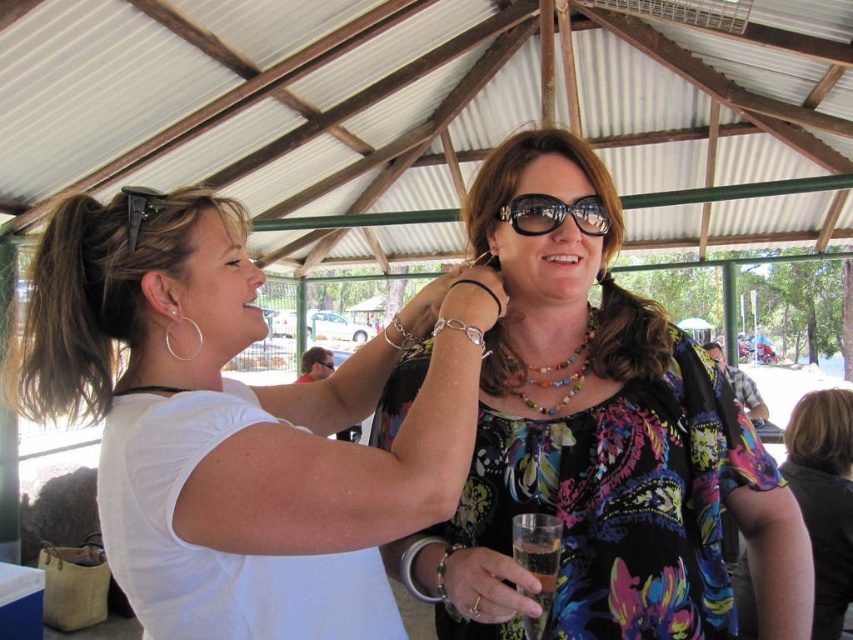
Is white matte shirt at upper left in front of multicolored beaded necklace at center?

That is True.

Is white matte shirt at upper left to the left of multicolored beaded necklace at center from the viewer's perspective?

Indeed, white matte shirt at upper left is positioned on the left side of multicolored beaded necklace at center.

This screenshot has width=853, height=640. In order to click on white matte shirt at upper left in this screenshot , I will do `click(238, 422)`.

Is white matte shirt at upper left closer to the viewer compared to shiny black sunglasses at center?

That is True.

Describe the element at coordinates (238, 422) in the screenshot. The width and height of the screenshot is (853, 640). I see `white matte shirt at upper left` at that location.

What do you see at coordinates (238, 422) in the screenshot? This screenshot has height=640, width=853. I see `white matte shirt at upper left` at bounding box center [238, 422].

Where is `white matte shirt at upper left`? This screenshot has width=853, height=640. white matte shirt at upper left is located at coordinates (238, 422).

Which is in front, point (517, 536) or point (593, 324)?

Point (517, 536) is in front.

Does clear plastic glass at center have a greater height compared to multicolored beaded necklace at center?

Correct, clear plastic glass at center is much taller as multicolored beaded necklace at center.

Is point (526, 536) closer to viewer compared to point (554, 381)?

Yes, it is in front of point (554, 381).

What are the coordinates of `clear plastic glass at center` in the screenshot? It's located at (537, 563).